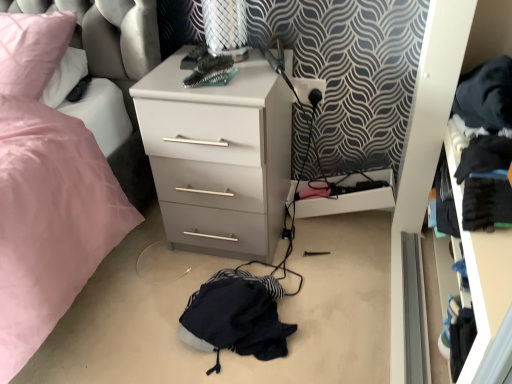
This screenshot has width=512, height=384. What are the coordinates of `free point below white plastic drawer at lower center (from a real-world perspective)` in the screenshot? It's located at (346, 220).